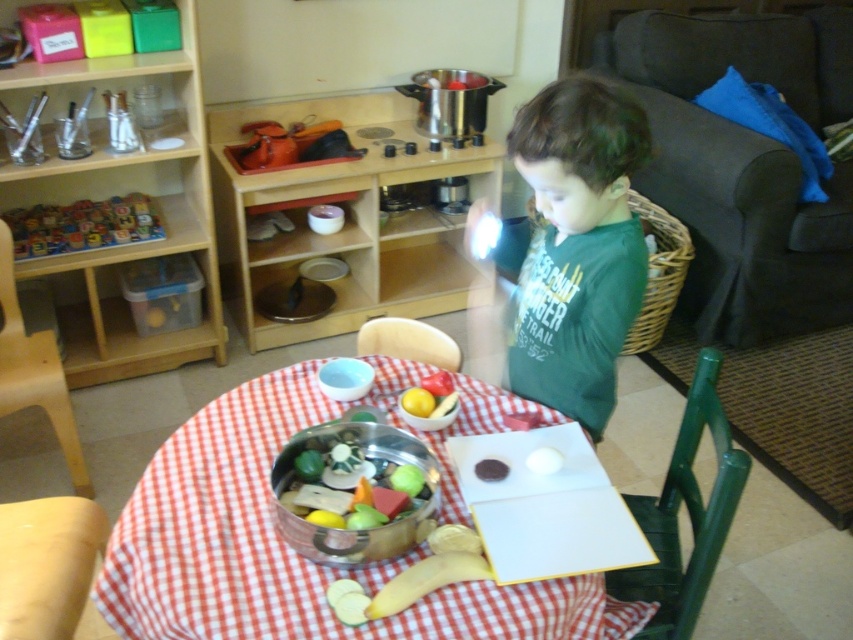
Between green cotton shirt at center and smooth brown cookie at center, which one has more height?

With more height is green cotton shirt at center.

Is point (618, 100) closer to viewer compared to point (488, 481)?

Yes, point (618, 100) is closer to viewer.

The image size is (853, 640). What do you see at coordinates (575, 244) in the screenshot?
I see `green cotton shirt at center` at bounding box center [575, 244].

Locate an element on the screen. This screenshot has width=853, height=640. green cotton shirt at center is located at coordinates (575, 244).

Does green cotton shirt at center have a smaller size compared to shiny metallic pot at center?

No.

Consider the image. Which is more to the left, green cotton shirt at center or shiny metallic pot at center?

shiny metallic pot at center

Does point (567, 138) come closer to viewer compared to point (341, 544)?

That is False.

Where is `green cotton shirt at center`? Image resolution: width=853 pixels, height=640 pixels. green cotton shirt at center is located at coordinates (575, 244).

Can you confirm if checkered fabric table at center is positioned to the right of smooth brown cookie at center?

Incorrect, checkered fabric table at center is not on the right side of smooth brown cookie at center.

Can you confirm if checkered fabric table at center is thinner than smooth brown cookie at center?

No.

Locate an element on the screen. The height and width of the screenshot is (640, 853). checkered fabric table at center is located at coordinates (291, 548).